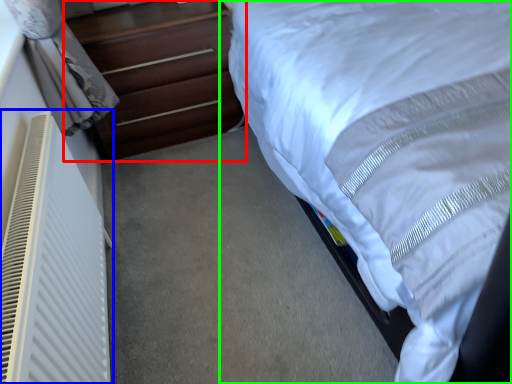
Question: Based on their relative distances, which object is nearer to chest of drawers (highlighted by a red box)? Choose from air conditioner (highlighted by a blue box) and bed (highlighted by a green box).

Choices:
 (A) air conditioner
 (B) bed

Answer: (B)